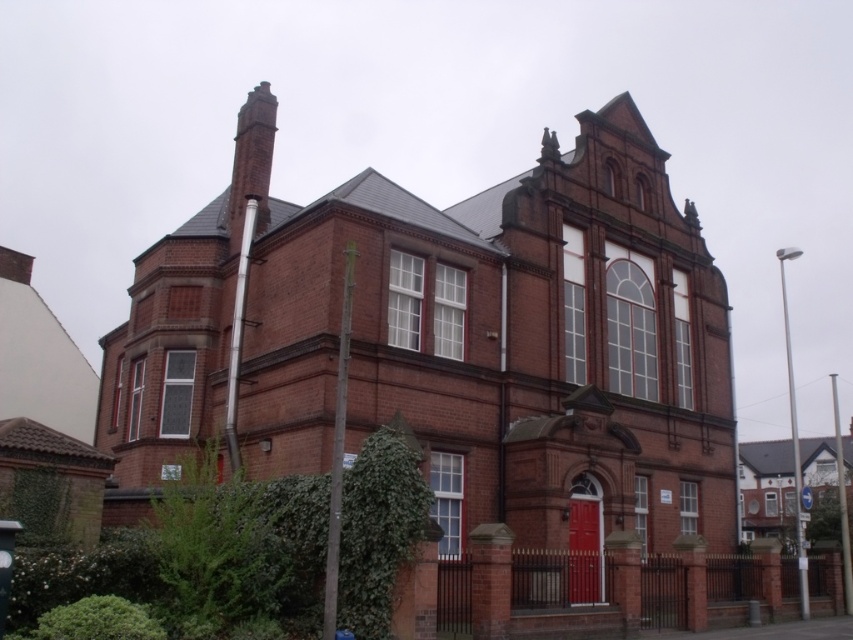
Question: Does red brick church at center appear under red brick chimney at upper left?

Choices:
 (A) no
 (B) yes

Answer: (B)

Question: Where is red brick church at center located in relation to red brick chimney at upper left in the image?

Choices:
 (A) right
 (B) left

Answer: (A)

Question: Is red brick church at center in front of red brick chimney at upper left?

Choices:
 (A) no
 (B) yes

Answer: (B)

Question: Which point is closer to the camera?

Choices:
 (A) (253, 157)
 (B) (509, 304)

Answer: (B)

Question: Which object appears farthest from the camera in this image?

Choices:
 (A) red brick church at center
 (B) red brick chimney at upper left

Answer: (B)

Question: Which object appears farthest from the camera in this image?

Choices:
 (A) red brick chimney at upper left
 (B) red brick church at center

Answer: (A)